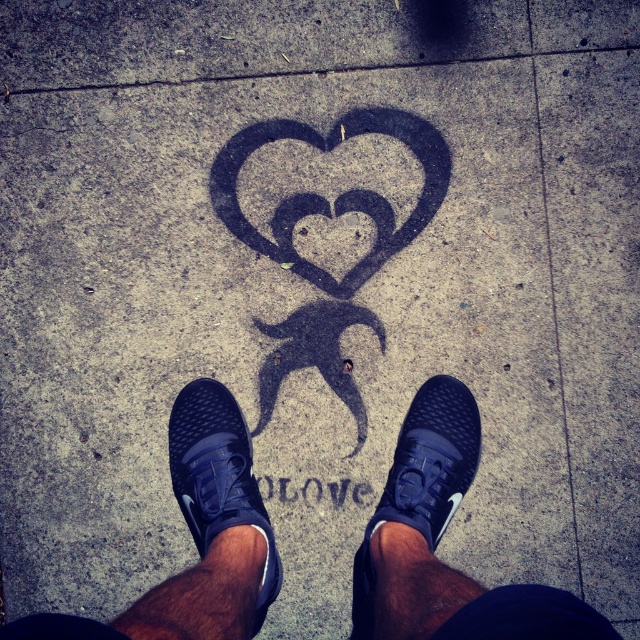
Question: Observing the image, what is the correct spatial positioning of black mesh sneakers at center in reference to matte black shoe at center?

Choices:
 (A) left
 (B) right

Answer: (A)

Question: Estimate the real-world distances between objects in this image. Which object is closer to the black mesh sneakers at center?

Choices:
 (A) black chalk heart at center
 (B) matte black shoe at center
 (C) black mesh shoe at center

Answer: (B)

Question: Does matte black shoe at center appear over black mesh shoe at center?

Choices:
 (A) yes
 (B) no

Answer: (B)

Question: Does matte black shoe at center have a greater width compared to black mesh shoe at center?

Choices:
 (A) yes
 (B) no

Answer: (A)

Question: Which point is closer to the camera taking this photo?

Choices:
 (A) (413, 474)
 (B) (220, 472)
 (C) (451, 600)

Answer: (C)

Question: Which of the following is the farthest from the observer?

Choices:
 (A) (182, 416)
 (B) (358, 618)

Answer: (B)